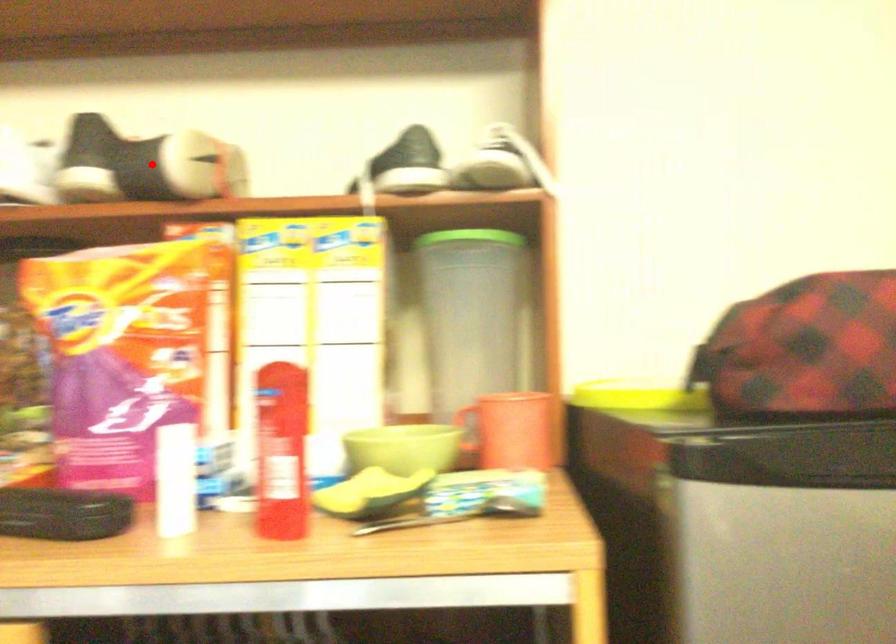
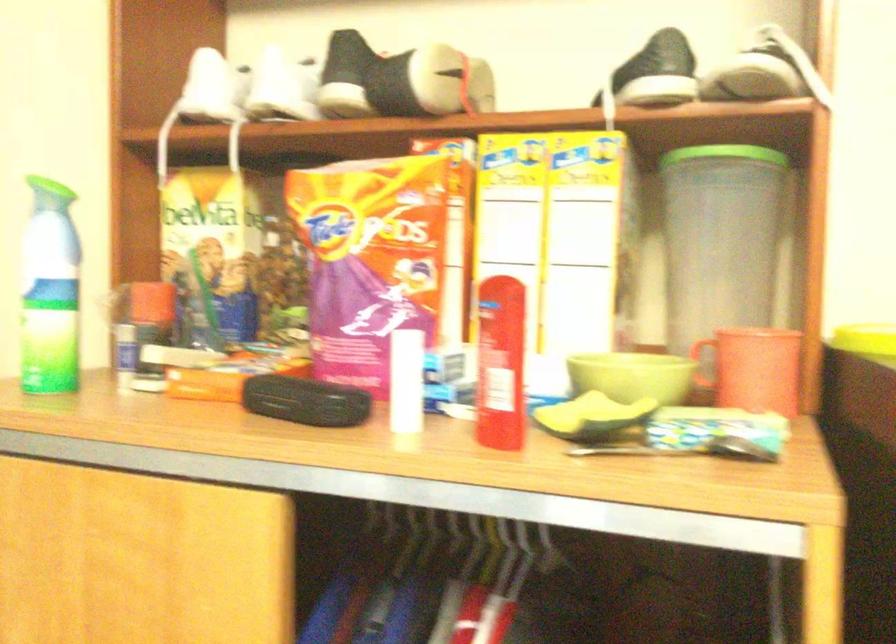
The point at the highlighted location is marked in the first image. Where is the corresponding point in the second image?

(401, 80)